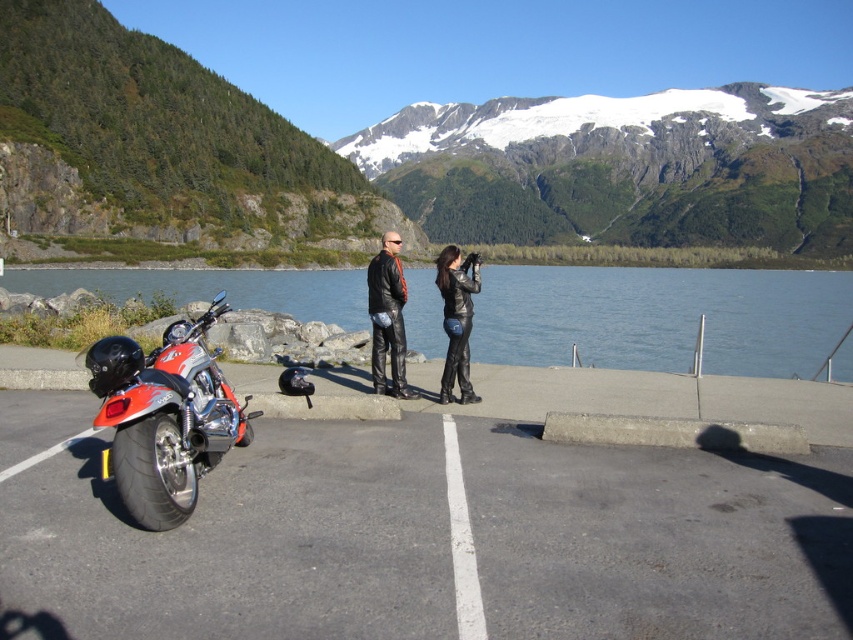
Question: Which object is positioned farthest from the shiny chrome motorcycle at lower left?

Choices:
 (A) clear water at center
 (B) leather jacket at center
 (C) snowy granite mountain at upper center
 (D) black leather jacket at center

Answer: (C)

Question: Is smooth asphalt parking lot at lower left closer to the viewer compared to clear water at center?

Choices:
 (A) no
 (B) yes

Answer: (B)

Question: Which object is the closest to the leather jacket at center?

Choices:
 (A) smooth asphalt parking lot at lower left
 (B) shiny chrome motorcycle at lower left

Answer: (B)

Question: Is shiny chrome motorcycle at lower left above black leather jacket at center?

Choices:
 (A) yes
 (B) no

Answer: (B)

Question: Can you confirm if smooth asphalt parking lot at lower left is positioned below shiny chrome motorcycle at lower left?

Choices:
 (A) yes
 (B) no

Answer: (A)

Question: Which point appears closest to the camera in this image?

Choices:
 (A) tap(390, 349)
 (B) tap(457, 349)

Answer: (B)